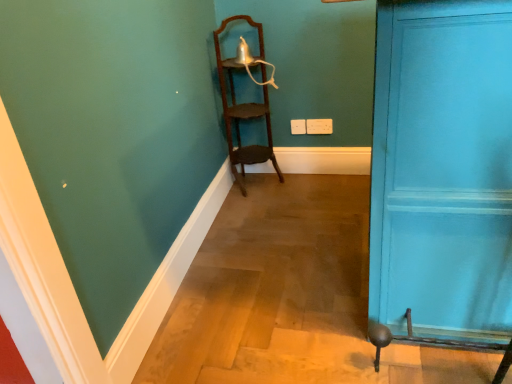
In order to click on wooden shelf at center in this screenshot , I will do `click(245, 103)`.

The width and height of the screenshot is (512, 384). What do you see at coordinates (245, 103) in the screenshot?
I see `wooden shelf at center` at bounding box center [245, 103].

Find the location of `wooden shelf at center`. wooden shelf at center is located at coordinates (245, 103).